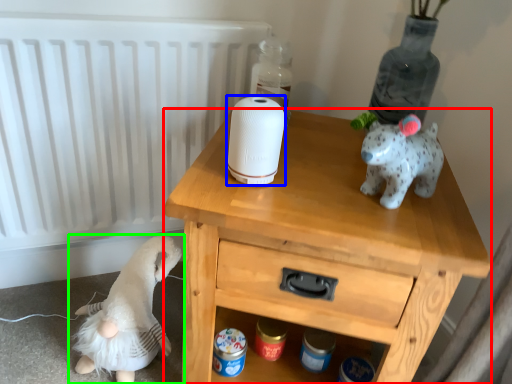
Question: Which object is positioned farthest from nightstand (highlighted by a red box)? Select from toilet paper (highlighted by a blue box) and toy (highlighted by a green box).

Choices:
 (A) toilet paper
 (B) toy

Answer: (B)